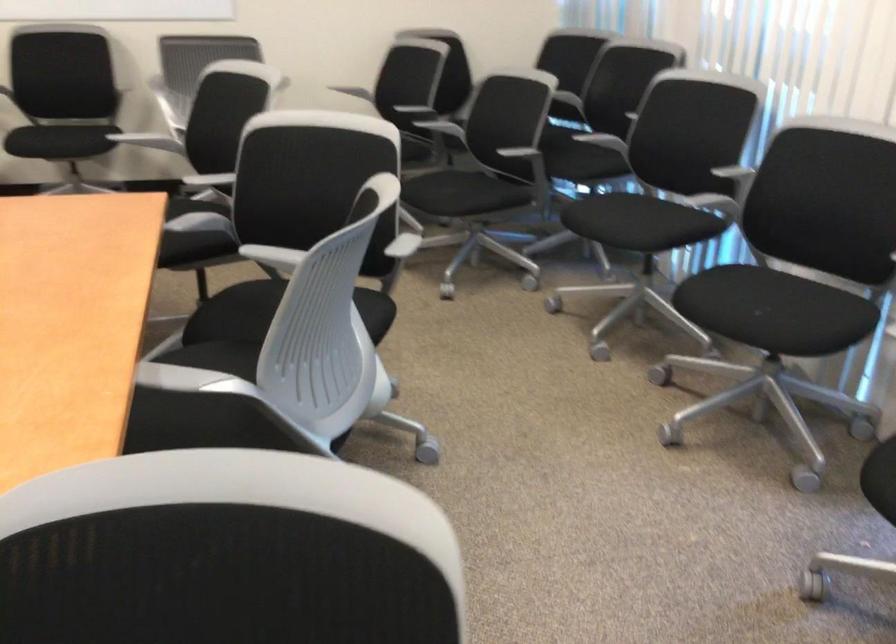
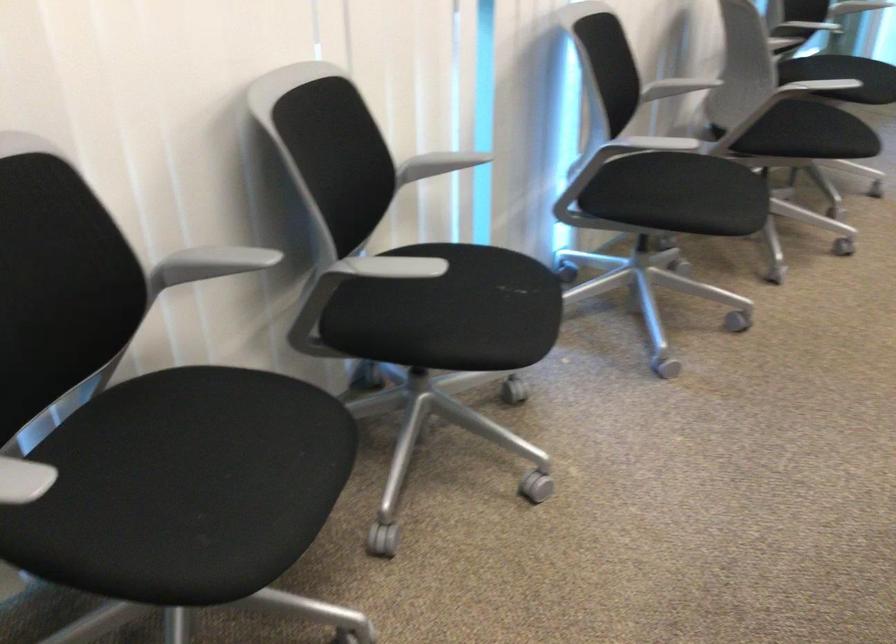
Locate, in the second image, the point that corresponds to [695,200] in the first image.

(384, 267)